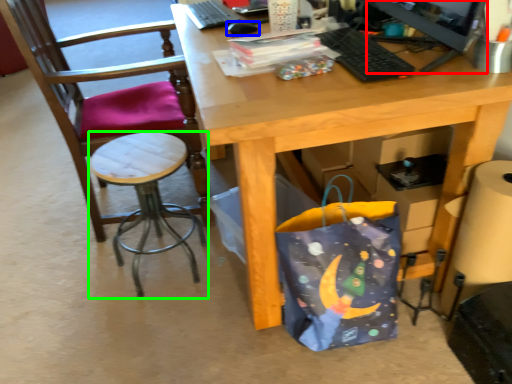
Question: Based on their relative distances, which object is nearer to computer monitor (highlighted by a red box)? Choose from mouse (highlighted by a blue box) and stool (highlighted by a green box).

Choices:
 (A) mouse
 (B) stool

Answer: (A)